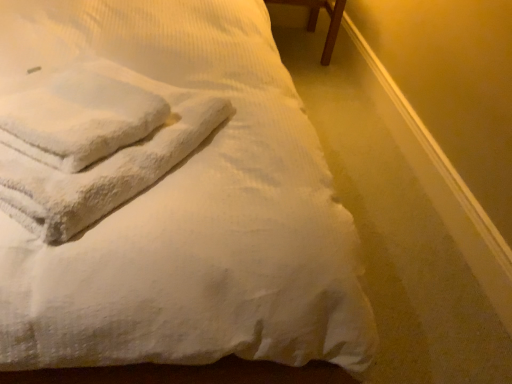
Describe the element at coordinates (317, 18) in the screenshot. The height and width of the screenshot is (384, 512). I see `brown wooden table at upper right` at that location.

You are a GUI agent. You are given a task and a screenshot of the screen. Output one action in this format:
    pyautogui.click(x=<x>, y=<y>)
    Task: Click on the brown wooden table at upper right
    This screenshot has width=512, height=384.
    Given the screenshot: What is the action you would take?
    pyautogui.click(x=317, y=18)

Identify the location of white fluffy bath towel at upper left, which is the first bath towel from left to right. This screenshot has height=384, width=512. (92, 142).

From the image's perspective, is brown wooden table at upper right on top of white soft towel at upper left?

Yes.

Is white soft towel at upper left located within brown wooden table at upper right?

That's incorrect, white soft towel at upper left is not inside brown wooden table at upper right.

The image size is (512, 384). What are the coordinates of `bed on the left of the brown wooden table at upper right` in the screenshot? It's located at tap(190, 211).

From the image's perspective, is white fluffy bath towel at upper left, which is the first bath towel from left to right, positioned above or below brown wooden table at upper right?

Clearly, from the image's perspective, white fluffy bath towel at upper left, which is the first bath towel from left to right, is below brown wooden table at upper right.

Considering the sizes of objects white fluffy bath towel at upper left, which is the first bath towel from left to right, and brown wooden table at upper right in the image provided, who is taller, white fluffy bath towel at upper left, which is the first bath towel from left to right, or brown wooden table at upper right?

brown wooden table at upper right is taller.

Which object is further away from the camera, white fluffy bath towel at upper left, placed as the second bath towel when sorted from right to left, or brown wooden table at upper right?

brown wooden table at upper right is further away from the camera.

From a real-world perspective, relative to brown wooden table at upper right, is white fluffy bath towel at upper left, which is the first bath towel from left to right, vertically above or below?

Clearly, from a real-world perspective, white fluffy bath towel at upper left, which is the first bath towel from left to right, is above brown wooden table at upper right.

From the image's perspective, is brown wooden table at upper right under white fluffy towel at upper left, the first bath towel positioned from the right?

No, from the image's perspective, brown wooden table at upper right is not below white fluffy towel at upper left, the first bath towel positioned from the right.

Who is taller, brown wooden table at upper right or white fluffy towel at upper left, the first bath towel positioned from the right?

brown wooden table at upper right is taller.

Which object is thinner, brown wooden table at upper right or white fluffy towel at upper left, the first bath towel positioned from the right?

With smaller width is white fluffy towel at upper left, the first bath towel positioned from the right.

Based on the photo, from a real-world perspective, is brown wooden table at upper right above or below white fluffy towel at upper left, positioned as the 2th bath towel in left-to-right order?

From a real-world perspective, brown wooden table at upper right is physically below white fluffy towel at upper left, positioned as the 2th bath towel in left-to-right order.

Does white fluffy bath towel at upper left, placed as the second bath towel when sorted from right to left, have a greater width compared to white fluffy towel at upper left, the first bath towel positioned from the right?

A: Yes.

Are white fluffy bath towel at upper left, placed as the second bath towel when sorted from right to left, and white fluffy towel at upper left, the first bath towel positioned from the right, located far from each other?

No, white fluffy bath towel at upper left, placed as the second bath towel when sorted from right to left, is in close proximity to white fluffy towel at upper left, the first bath towel positioned from the right.

Which object is positioned more to the right, white fluffy bath towel at upper left, placed as the second bath towel when sorted from right to left, or white fluffy towel at upper left, the first bath towel positioned from the right?

white fluffy towel at upper left, the first bath towel positioned from the right, is more to the right.

Measure the distance between white fluffy bath towel at upper left, which is the first bath towel from left to right, and white fluffy towel at upper left, the first bath towel positioned from the right.

white fluffy bath towel at upper left, which is the first bath towel from left to right, and white fluffy towel at upper left, the first bath towel positioned from the right, are 0.84 inches apart.

Between white soft towel at upper left and brown wooden table at upper right, which one appears on the right side from the viewer's perspective?

brown wooden table at upper right is more to the right.

From a real-world perspective, is white soft towel at upper left above or below brown wooden table at upper right?

white soft towel at upper left is situated higher than brown wooden table at upper right in the real world.

From the image's perspective, between white soft towel at upper left and brown wooden table at upper right, who is located below?

white soft towel at upper left.

Which of these two, white soft towel at upper left or brown wooden table at upper right, stands shorter?

brown wooden table at upper right is shorter.

Can we say white fluffy towel at upper left, positioned as the 2th bath towel in left-to-right order, lies outside white soft towel at upper left?

No, white fluffy towel at upper left, positioned as the 2th bath towel in left-to-right order, is not entirely external to white soft towel at upper left.

Considering the points (34, 138) and (60, 248), which point is behind, point (34, 138) or point (60, 248)?

The point (34, 138) is behind.

Relative to white soft towel at upper left, is white fluffy towel at upper left, the first bath towel positioned from the right, in front or behind?

Visually, white fluffy towel at upper left, the first bath towel positioned from the right, is located behind white soft towel at upper left.

Is white fluffy towel at upper left, the first bath towel positioned from the right, inside or outside of brown wooden table at upper right?

The correct answer is: outside.

Who is taller, white fluffy towel at upper left, the first bath towel positioned from the right, or brown wooden table at upper right?

brown wooden table at upper right is taller.

Which object is closer to the camera, white fluffy towel at upper left, the first bath towel positioned from the right, or brown wooden table at upper right?

white fluffy towel at upper left, the first bath towel positioned from the right, is more forward.

Does white fluffy towel at upper left, the first bath towel positioned from the right, appear on the right side of brown wooden table at upper right?

In fact, white fluffy towel at upper left, the first bath towel positioned from the right, is to the left of brown wooden table at upper right.

This screenshot has width=512, height=384. Find the location of `bed on the left of brown wooden table at upper right`. bed on the left of brown wooden table at upper right is located at coordinates (190, 211).

I want to click on the 2nd bath towel in front of the brown wooden table at upper right, so click(x=92, y=142).

When comparing their distances from white fluffy bath towel at upper left, placed as the second bath towel when sorted from right to left, does brown wooden table at upper right or white fluffy towel at upper left, positioned as the 2th bath towel in left-to-right order, seem closer?

white fluffy towel at upper left, positioned as the 2th bath towel in left-to-right order, is positioned closer to the anchor white fluffy bath towel at upper left, placed as the second bath towel when sorted from right to left.

In the scene shown: Estimate the real-world distances between objects in this image. Which object is further from brown wooden table at upper right, white soft towel at upper left or white fluffy bath towel at upper left, which is the first bath towel from left to right?

white fluffy bath towel at upper left, which is the first bath towel from left to right, lies further to brown wooden table at upper right than the other object.

In the scene shown: Based on their spatial positions, is white soft towel at upper left or brown wooden table at upper right closer to white fluffy bath towel at upper left, which is the first bath towel from left to right?

white soft towel at upper left lies closer to white fluffy bath towel at upper left, which is the first bath towel from left to right, than the other object.

Looking at this image, estimate the real-world distances between objects in this image. Which object is closer to white soft towel at upper left, white fluffy towel at upper left, the first bath towel positioned from the right, or white fluffy bath towel at upper left, placed as the second bath towel when sorted from right to left?

Among the two, white fluffy bath towel at upper left, placed as the second bath towel when sorted from right to left, is located nearer to white soft towel at upper left.

From the picture: Estimate the real-world distances between objects in this image. Which object is closer to white fluffy towel at upper left, the first bath towel positioned from the right, white fluffy bath towel at upper left, which is the first bath towel from left to right, or brown wooden table at upper right?

The object closer to white fluffy towel at upper left, the first bath towel positioned from the right, is white fluffy bath towel at upper left, which is the first bath towel from left to right.

From the image, which object appears to be farther from brown wooden table at upper right, white soft towel at upper left or white fluffy towel at upper left, the first bath towel positioned from the right?

The object further to brown wooden table at upper right is white fluffy towel at upper left, the first bath towel positioned from the right.

When comparing their distances from white soft towel at upper left, does brown wooden table at upper right or white fluffy bath towel at upper left, placed as the second bath towel when sorted from right to left, seem further?

brown wooden table at upper right.

In the scene shown: Which object lies nearer to the anchor point white soft towel at upper left, white fluffy bath towel at upper left, placed as the second bath towel when sorted from right to left, or white fluffy towel at upper left, positioned as the 2th bath towel in left-to-right order?

Among the two, white fluffy bath towel at upper left, placed as the second bath towel when sorted from right to left, is located nearer to white soft towel at upper left.

The width and height of the screenshot is (512, 384). I want to click on bath towel between white fluffy bath towel at upper left, placed as the second bath towel when sorted from right to left, and brown wooden table at upper right, along the z-axis, so click(x=77, y=114).

Where is `bath towel between white soft towel at upper left and white fluffy towel at upper left, positioned as the 2th bath towel in left-to-right order, along the z-axis`? The width and height of the screenshot is (512, 384). bath towel between white soft towel at upper left and white fluffy towel at upper left, positioned as the 2th bath towel in left-to-right order, along the z-axis is located at coordinates (92, 142).